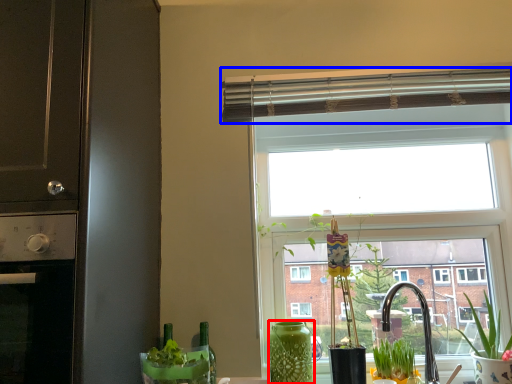
Question: Which object appears farthest to the camera in this image, vase (highlighted by a red box) or window blind (highlighted by a blue box)?

Choices:
 (A) vase
 (B) window blind

Answer: (B)